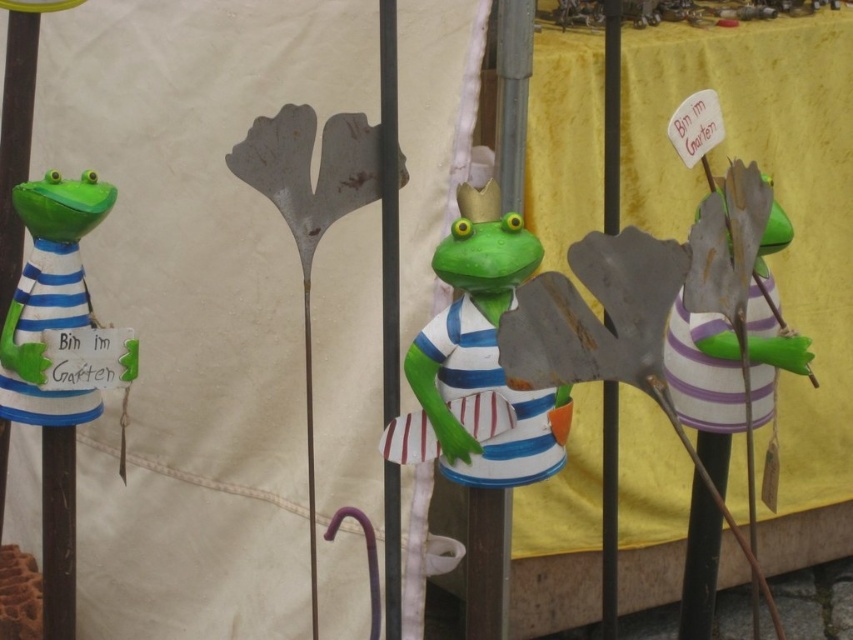
You are a gardener looking at the frogs on the railing. You need to place a new small plant between the matte green frog at center and the green matte frog at left. Which frog should the plant be closer to if it needs to be placed near the smaller frog?

The green matte frog at left is smaller in size than the matte green frog at center. Therefore, the plant should be placed closer to the green matte frog at left.

You are a gardener looking at the frogs on the railing. Which frog is directly above the other between the matte green frog at center and the green matte frog at left?

The green matte frog at left is directly above the matte green frog at center because the matte green frog at center is positioned under the green matte frog at left.